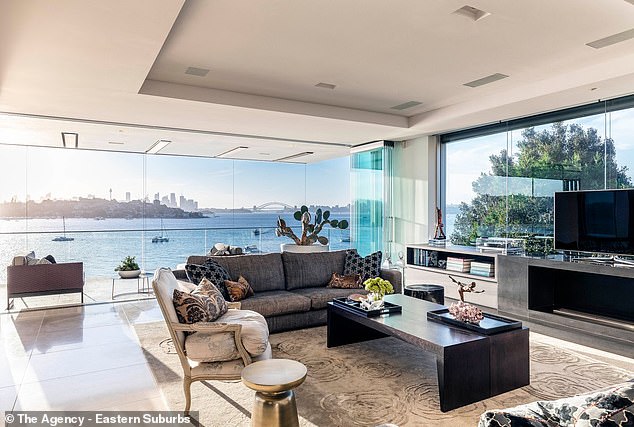
In order to click on brass side table in this screenshot , I will do `click(283, 373)`.